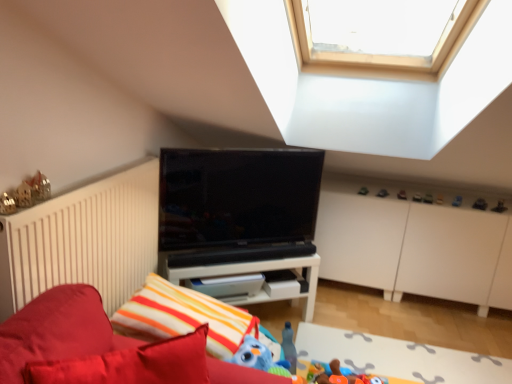
Locate an element on the screen. This screenshot has width=512, height=384. free space to the back side of smooth plastic toy at center, positioned as the seventh toy in front-to-back order is located at coordinates (426, 190).